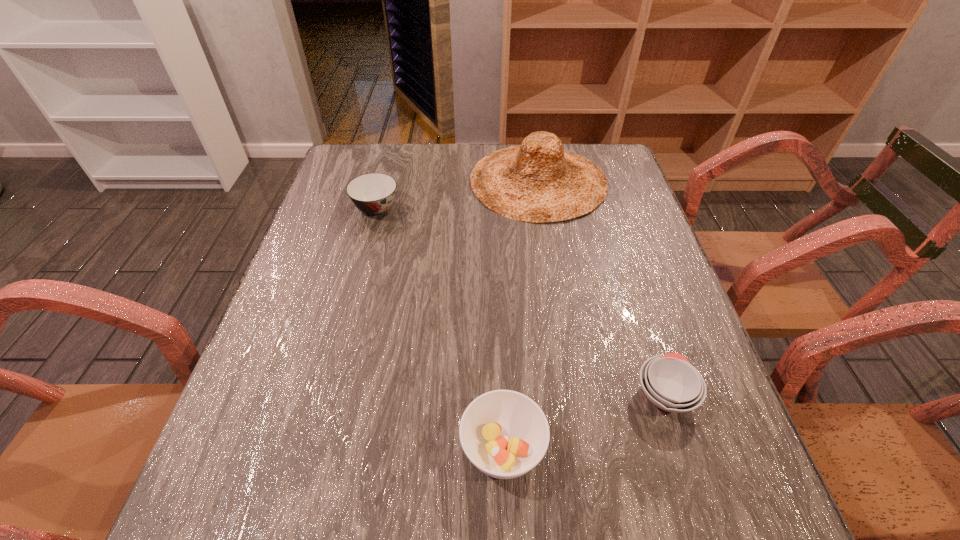
I want to click on sunhat, so click(537, 181).

Locate an element on the screen. This screenshot has width=960, height=540. the leftmost object is located at coordinates (373, 193).

This screenshot has width=960, height=540. Find the location of `the leftmost soup bowl`. the leftmost soup bowl is located at coordinates (373, 193).

Image resolution: width=960 pixels, height=540 pixels. Identify the location of the second soup bowl from right to left. (505, 434).

Where is `the shortest object`? This screenshot has height=540, width=960. the shortest object is located at coordinates (670, 382).

Where is `the rightmost soup bowl`? Image resolution: width=960 pixels, height=540 pixels. the rightmost soup bowl is located at coordinates (670, 382).

This screenshot has height=540, width=960. In order to click on vacant space located 0.130m on the front of the tallest object in this screenshot , I will do `click(550, 258)`.

The image size is (960, 540). I want to click on free space located on the front of the leftmost object, so click(x=367, y=244).

Where is `vacant space located 0.240m on the right of the second soup bowl from left to right`? vacant space located 0.240m on the right of the second soup bowl from left to right is located at coordinates (686, 449).

The image size is (960, 540). What are the coordinates of `vacant space located 0.220m on the back of the rightmost soup bowl` in the screenshot? It's located at (629, 285).